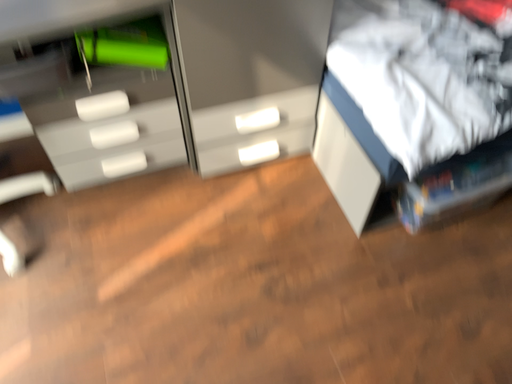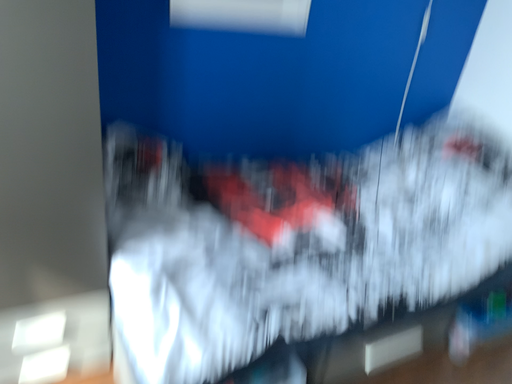
Question: Which way did the camera rotate in the video?

Choices:
 (A) rotated downward
 (B) rotated upward

Answer: (B)